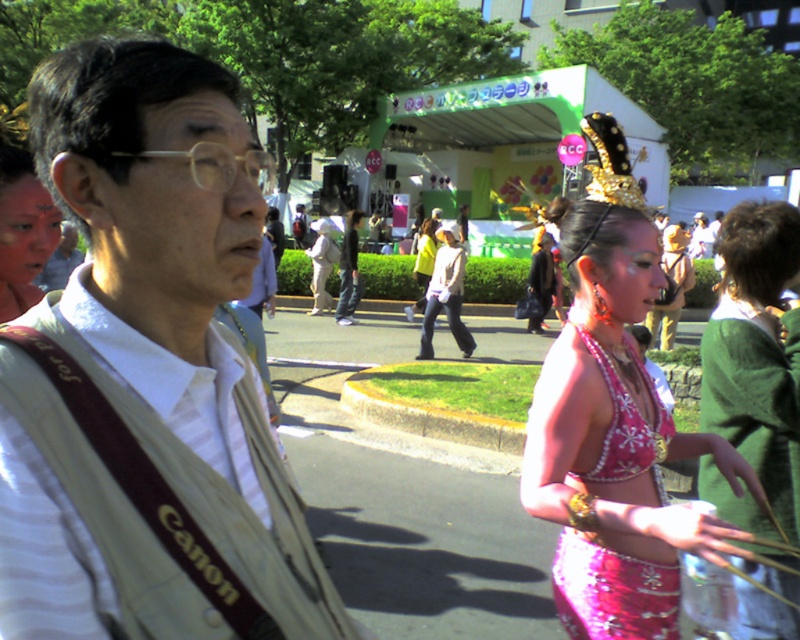
Question: Which point is closer to the camera?

Choices:
 (A) pink sequined bikini top at center
 (B) pink sequined skirt at center

Answer: (B)

Question: Is pink sequined bikini top at right thinner than white cotton shirt at center?

Choices:
 (A) yes
 (B) no

Answer: (B)

Question: Is white fabric shirt at left positioned behind shiny pink bikini at center?

Choices:
 (A) yes
 (B) no

Answer: (B)

Question: Is pink sequined bikini top at center positioned at the back of white cotton shirt at center?

Choices:
 (A) yes
 (B) no

Answer: (B)

Question: Which point appears farthest from the camera in this image?

Choices:
 (A) (466, 333)
 (B) (598, 353)
 (C) (584, 250)
 (D) (713, 397)

Answer: (A)

Question: Which object appears farthest from the camera in this image?

Choices:
 (A) pink sequined bikini top at right
 (B) shiny pink bikini at center
 (C) pink sequined bikini top at center
 (D) white cotton shirt at center

Answer: (B)